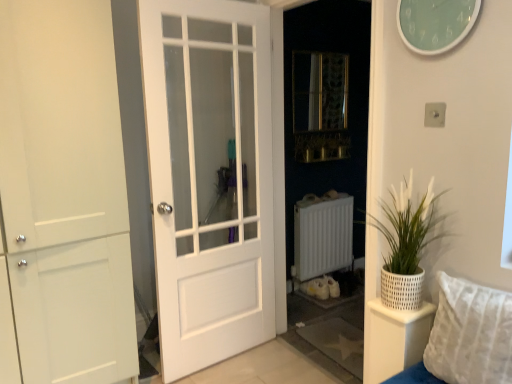
Locate an element on the screen. This screenshot has width=512, height=384. vacant area situated below white glass door at center, the 1th door when ordered from right to left (from a real-world perspective) is located at coordinates (223, 355).